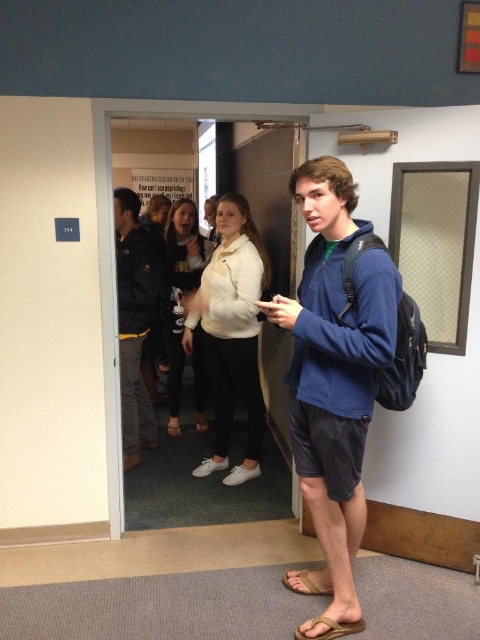
Does point (128, 264) come in front of point (312, 584)?

No.

I want to click on dark blue jacket at center, so click(x=134, y=320).

From the picture: Between white matte jacket at center and white soft sweater at center, which one has less height?

Standing shorter between the two is white matte jacket at center.

Who is positioned more to the left, white matte jacket at center or white soft sweater at center?

Positioned to the left is white soft sweater at center.

Identify the location of white matte jacket at center. (230, 333).

Identify the location of white matte jacket at center. This screenshot has width=480, height=640. (230, 333).

Can you confirm if dark blue jacket at center is positioned to the left of brown leather sandal at lower center?

Correct, you'll find dark blue jacket at center to the left of brown leather sandal at lower center.

The image size is (480, 640). What do you see at coordinates (134, 320) in the screenshot?
I see `dark blue jacket at center` at bounding box center [134, 320].

Locate an element on the screen. The width and height of the screenshot is (480, 640). dark blue jacket at center is located at coordinates (134, 320).